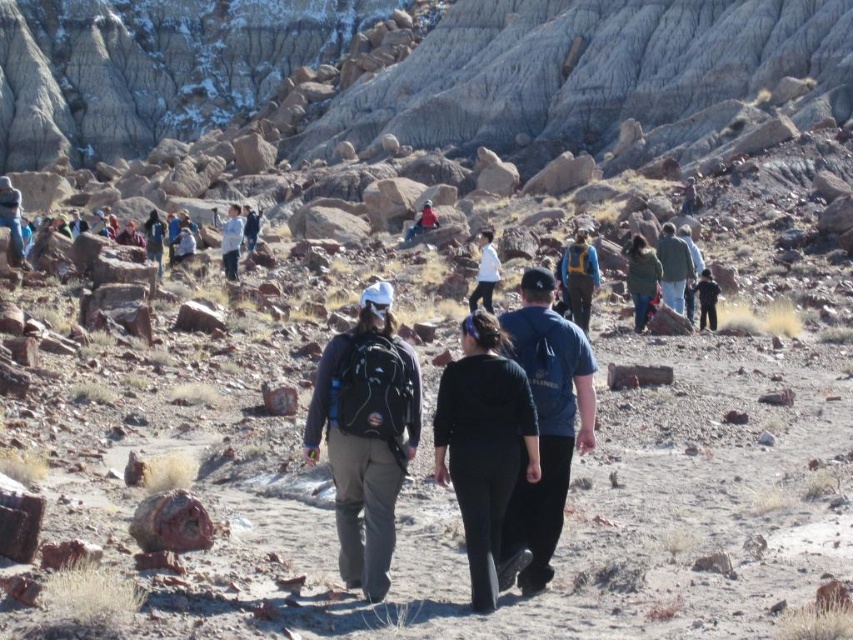
Question: Which object is positioned farthest from the light blue denim jacket at center?

Choices:
 (A) dark blue jacket at center
 (B) blue fabric shirt at center
 (C) green matte jacket at center-right

Answer: (B)

Question: Is black matte pants at center to the right of blue backpack at center from the viewer's perspective?

Choices:
 (A) no
 (B) yes

Answer: (A)

Question: Which point appears closest to the camera in this image?

Choices:
 (A) (157, 259)
 (B) (703, 273)
 (C) (567, 406)

Answer: (C)

Question: Observing the image, what is the correct spatial positioning of black matte pants at center in reference to light blue denim jacket at center?

Choices:
 (A) left
 (B) right

Answer: (B)

Question: Is blue backpack at center in front of green matte jacket at center-right?

Choices:
 (A) yes
 (B) no

Answer: (A)

Question: Which point is farther to the camera?

Choices:
 (A) dark blue jacket at center
 (B) green fuzzy jacket at center
 (C) blue fabric shirt at center
 (D) black matte pants at center

Answer: (B)